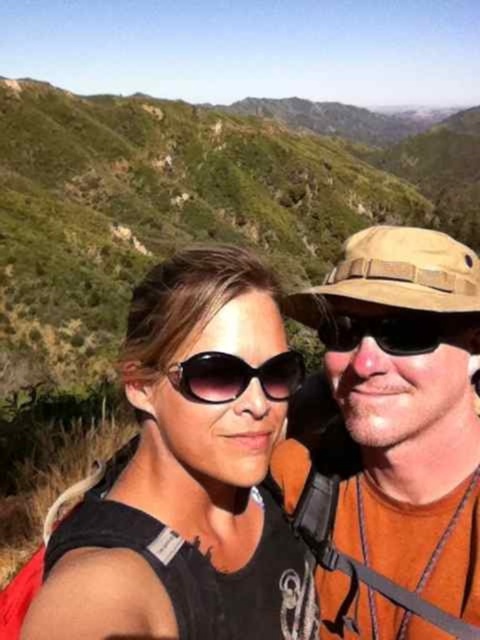
Is matte black tank top at center smaller than black matte sunglasses at center?

No, matte black tank top at center is not smaller than black matte sunglasses at center.

Is matte black tank top at center closer to the viewer compared to black matte sunglasses at center?

Yes, it is in front of black matte sunglasses at center.

Which is behind, point (210, 560) or point (377, 339)?

Positioned behind is point (377, 339).

Locate an element on the screen. matte black tank top at center is located at coordinates [x=190, y=472].

Based on the photo, is black matte sunglasses at center positioned before matte black sunglasses at center?

No.

Can you confirm if black matte sunglasses at center is shorter than matte black sunglasses at center?

Yes.

The height and width of the screenshot is (640, 480). Describe the element at coordinates (399, 330) in the screenshot. I see `black matte sunglasses at center` at that location.

Where is `black matte sunglasses at center`? This screenshot has height=640, width=480. black matte sunglasses at center is located at coordinates (399, 330).

The image size is (480, 640). Find the location of `brown canvas hat at upper right`. brown canvas hat at upper right is located at coordinates point(393,440).

Can you confirm if brown canvas hat at upper right is bigger than matte black sunglasses at center?

Yes, brown canvas hat at upper right is bigger than matte black sunglasses at center.

Which is in front, point (419, 442) or point (183, 384)?

Positioned in front is point (183, 384).

The height and width of the screenshot is (640, 480). Identify the location of brown canvas hat at upper right. (393, 440).